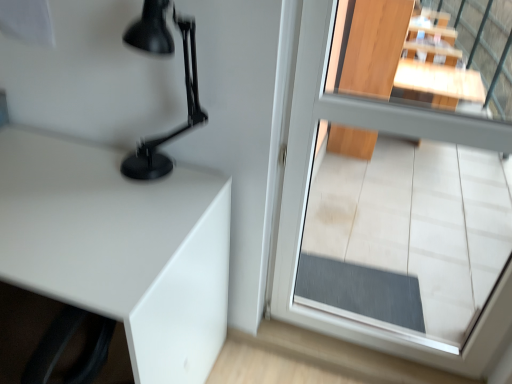
Question: Does matte black lamp at upper left come behind transparent glass door at center?

Choices:
 (A) no
 (B) yes

Answer: (B)

Question: Is matte black lamp at upper left taller than transparent glass door at center?

Choices:
 (A) no
 (B) yes

Answer: (A)

Question: Is matte black lamp at upper left positioned with its back to transparent glass door at center?

Choices:
 (A) yes
 (B) no

Answer: (B)

Question: Is matte black lamp at upper left next to transparent glass door at center and touching it?

Choices:
 (A) yes
 (B) no

Answer: (B)

Question: From a real-world perspective, is matte black lamp at upper left below transparent glass door at center?

Choices:
 (A) yes
 (B) no

Answer: (B)

Question: Can you confirm if matte black lamp at upper left is smaller than transparent glass door at center?

Choices:
 (A) no
 (B) yes

Answer: (B)

Question: From a real-world perspective, is transparent glass door at center on top of white glossy table at left?

Choices:
 (A) yes
 (B) no

Answer: (A)

Question: Can you confirm if transparent glass door at center is taller than white glossy table at left?

Choices:
 (A) no
 (B) yes

Answer: (B)

Question: Are transparent glass door at center and white glossy table at left making contact?

Choices:
 (A) yes
 (B) no

Answer: (B)

Question: Can you confirm if transparent glass door at center is smaller than white glossy table at left?

Choices:
 (A) yes
 (B) no

Answer: (A)

Question: Is transparent glass door at center completely or partially outside of white glossy table at left?

Choices:
 (A) yes
 (B) no

Answer: (A)

Question: Is transparent glass door at center oriented away from white glossy table at left?

Choices:
 (A) no
 (B) yes

Answer: (A)

Question: Is transparent glass door at center thinner than matte black lamp at upper left?

Choices:
 (A) yes
 (B) no

Answer: (A)